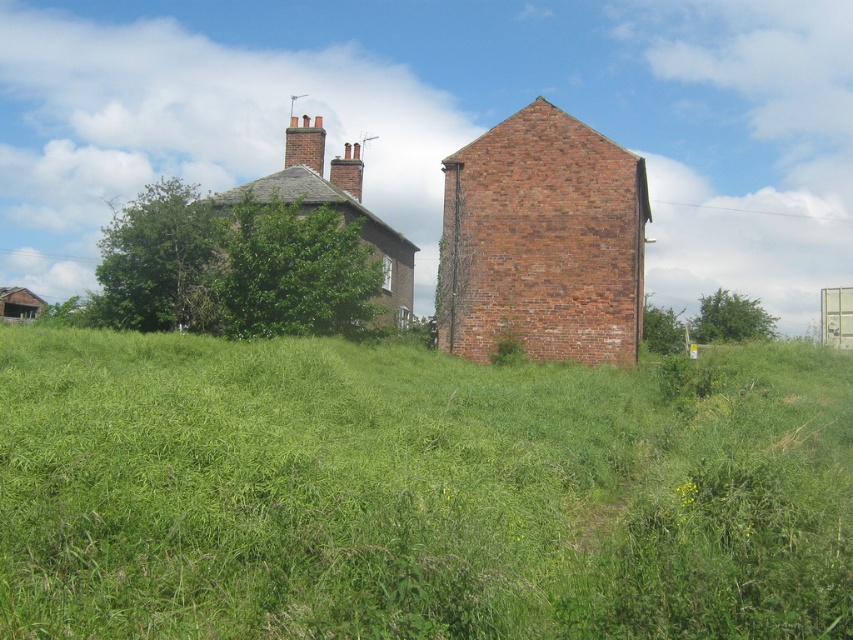
Question: Which object is farther from the camera taking this photo?

Choices:
 (A) green grass at center
 (B) red brick chimney at center

Answer: (B)

Question: Does green grass at center lie in front of red brick chimney at upper center?

Choices:
 (A) yes
 (B) no

Answer: (A)

Question: Can you confirm if green grass at center is positioned above red brick chimney at center?

Choices:
 (A) yes
 (B) no

Answer: (B)

Question: Is green grass at center smaller than red brick chimney at upper center?

Choices:
 (A) yes
 (B) no

Answer: (B)

Question: Which of the following is the farthest from the observer?

Choices:
 (A) (567, 477)
 (B) (323, 138)

Answer: (B)

Question: Which point appears farthest from the camera in this image?

Choices:
 (A) (317, 160)
 (B) (685, 518)
 (C) (335, 161)

Answer: (C)